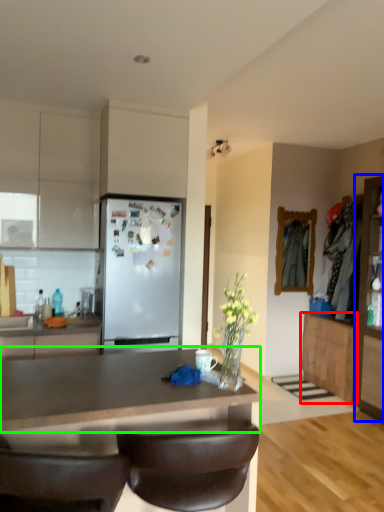
Question: Estimate the real-world distances between objects in this image. Which object is farther from cabinetry (highlighted by a red box), cabinetry (highlighted by a blue box) or countertop (highlighted by a green box)?

Choices:
 (A) cabinetry
 (B) countertop

Answer: (B)